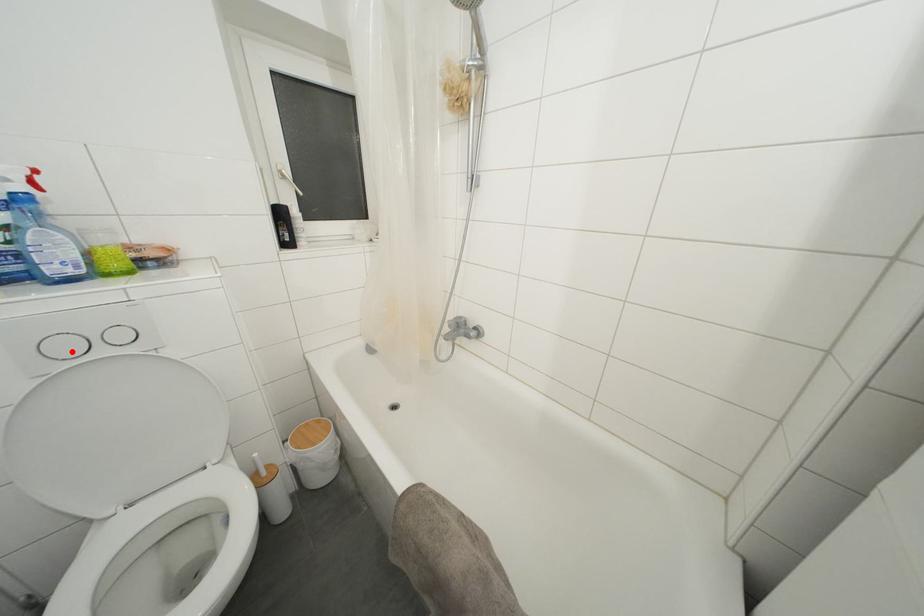
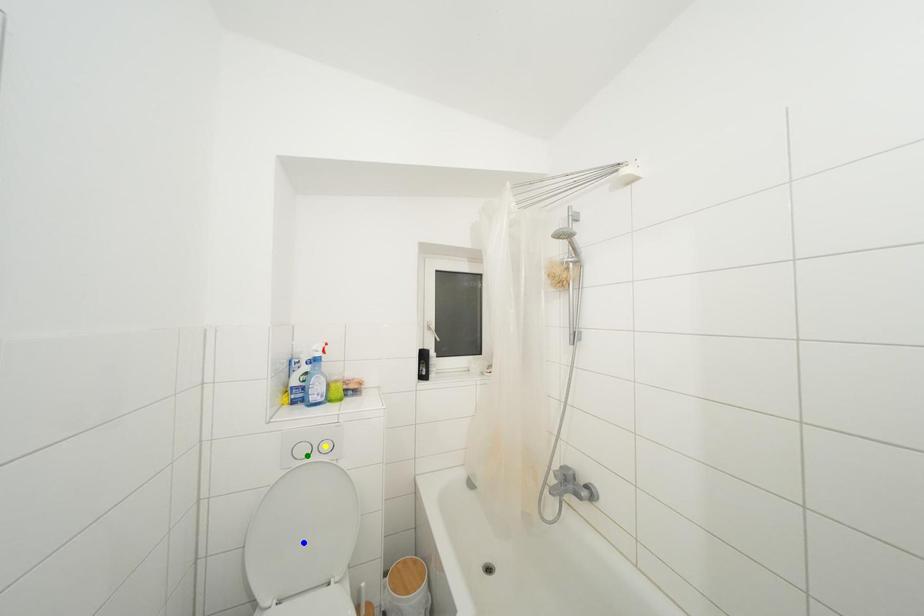
Question: I am providing you with two images of the same scene from different viewpoints. A red point is marked on the first image. You are given multiple points on the second image. Can you choose the point in image 2 that corresponds to the point in image 1?

Choices:
 (A) blue point
 (B) yellow point
 (C) green point

Answer: (C)